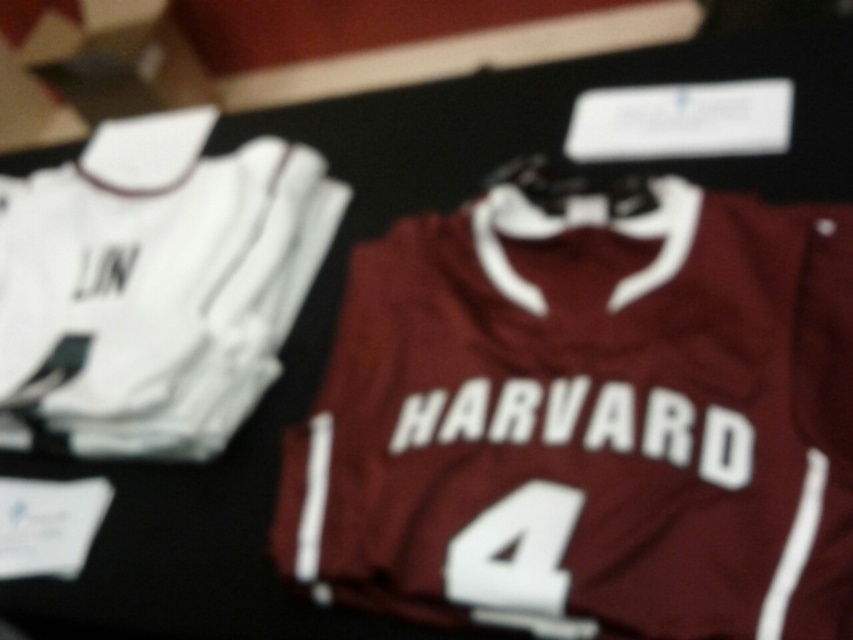
Which is below, maroon jersey at right or white fabric number at center?

Positioned lower is white fabric number at center.

Identify the location of maroon jersey at right. This screenshot has width=853, height=640. (589, 420).

Looking at this image, between maroon jersey at right and white jersey at left, which one appears on the left side from the viewer's perspective?

Positioned to the left is white jersey at left.

Which is in front, point (808, 304) or point (283, 140)?

Positioned in front is point (808, 304).

Does point (509, 406) come closer to viewer compared to point (129, 323)?

Yes, it is.

Find the location of a particular element. The height and width of the screenshot is (640, 853). maroon jersey at right is located at coordinates (589, 420).

Who is shorter, white jersey at left or white fabric number at center?

Standing shorter between the two is white fabric number at center.

Can you confirm if white jersey at left is taller than white fabric number at center?

Yes, white jersey at left is taller than white fabric number at center.

At what (x,y) coordinates should I click in order to perform the action: click on white jersey at left. Please return your answer as a coordinate pair (x, y). The width and height of the screenshot is (853, 640). Looking at the image, I should click on [155, 284].

Where is `white jersey at left`? The height and width of the screenshot is (640, 853). white jersey at left is located at coordinates (155, 284).